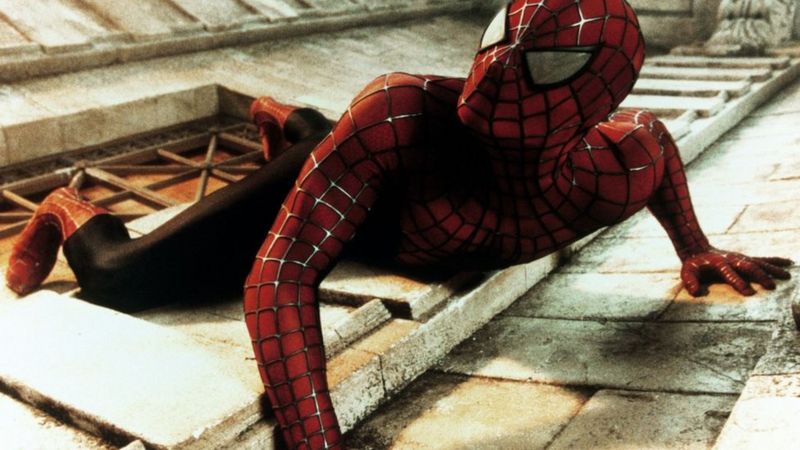
I want to click on eye hole, so click(x=541, y=70), click(x=493, y=28).